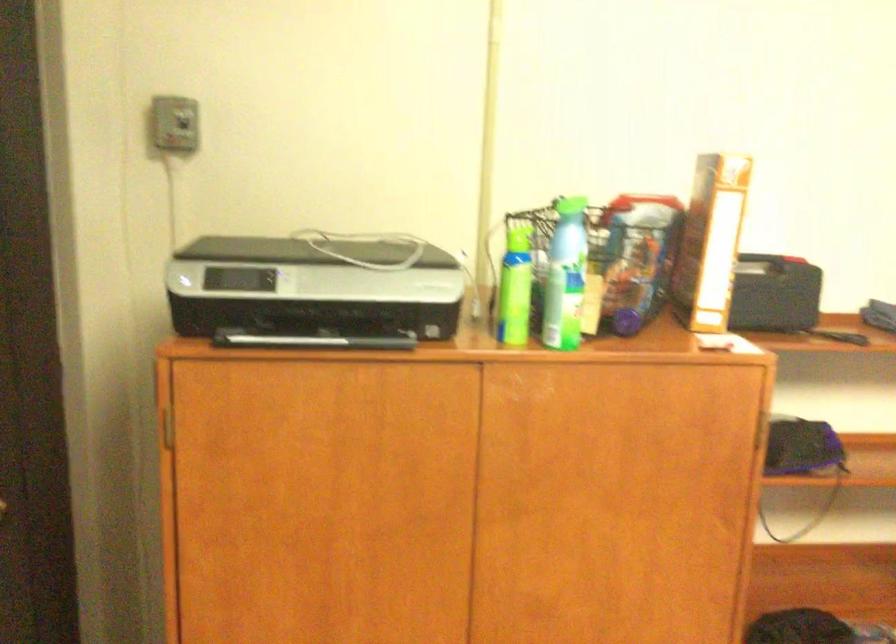
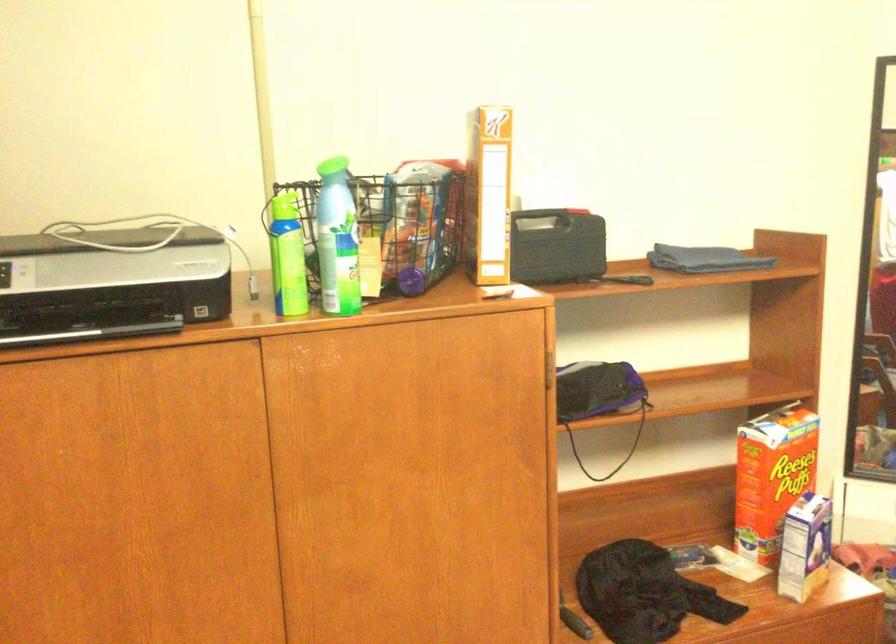
Where in the second image is the point corresponding to point 517,240 from the first image?

(285, 205)